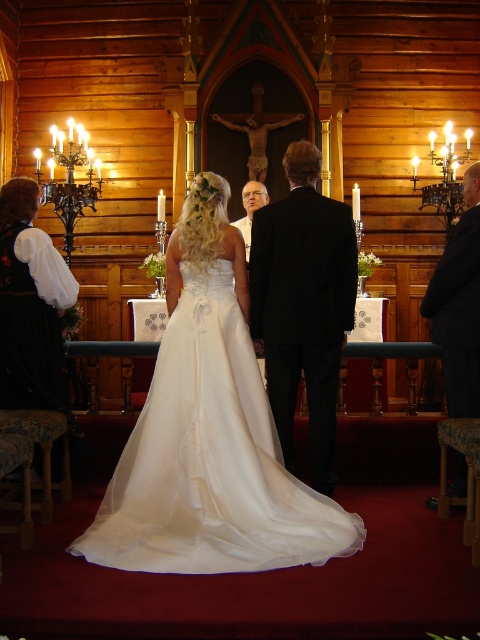
Question: Does black suit at right appear over matte black suit at center?

Choices:
 (A) no
 (B) yes

Answer: (A)

Question: Is satin white dress at center bigger than black suit at right?

Choices:
 (A) yes
 (B) no

Answer: (A)

Question: Among these points, which one is farthest from the camera?

Choices:
 (A) (247, 252)
 (B) (36, 404)
 (C) (128, 486)

Answer: (A)

Question: Which is farther from the matte black suit at center?

Choices:
 (A) black satin suit at center
 (B) satin white dress at center
 (C) black suit at right
 (D) white satin dress at left

Answer: (B)

Question: Where is black satin suit at center located in relation to white satin dress at left in the image?

Choices:
 (A) left
 (B) right

Answer: (B)

Question: Among these objects, which one is farthest from the camera?

Choices:
 (A) black suit at right
 (B) satin white dress at center
 (C) white satin dress at left

Answer: (C)